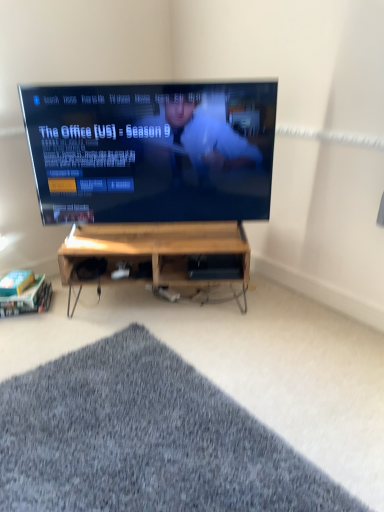
Locate an element on the screen. free point above woodenmaterial/texturedesk at center (from a real-world perspective) is located at coordinates (167, 237).